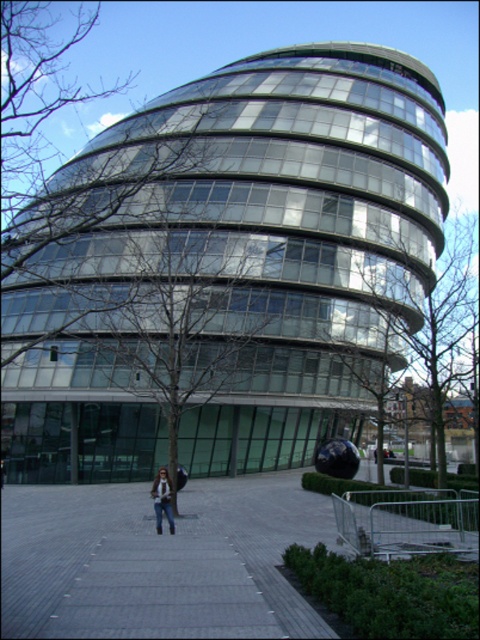
You are standing in front of the modern building and want to take a photo of the gray concrete pavement at center and the green leafy tree at center. Which object should you focus on first if you want to capture both in a single frame without moving the camera?

You should focus on the gray concrete pavement at center first because it is located below the green leafy tree at center, so adjusting the camera to include both would require ensuring the lower object is in frame first.